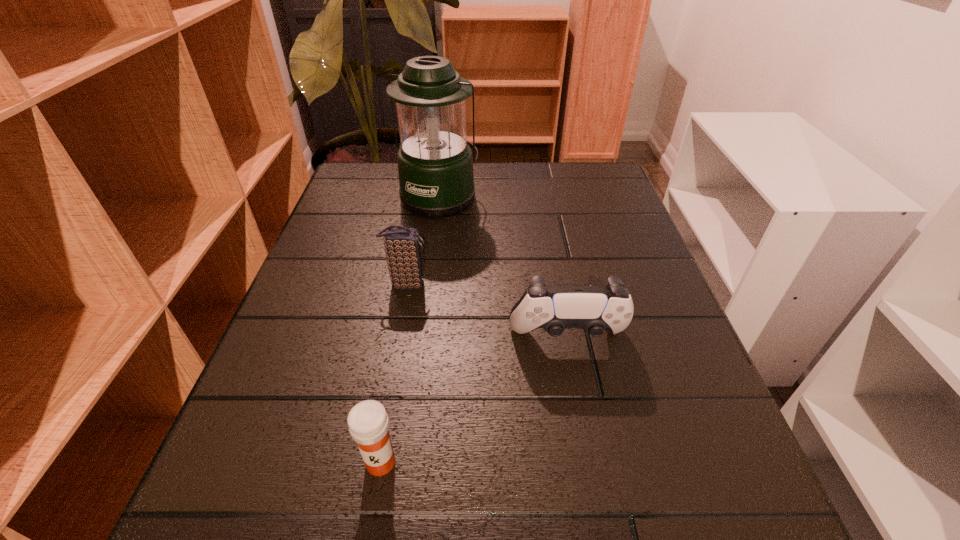
Find the location of a particular element. The height and width of the screenshot is (540, 960). unoccupied position between the nearest object and the tallest object is located at coordinates (410, 329).

I want to click on vacant area between the rightmost object and the farthest object, so click(504, 268).

This screenshot has width=960, height=540. I want to click on free space between the nearest object and the third nearest object, so click(394, 373).

You are a GUI agent. You are given a task and a screenshot of the screen. Output one action in this format:
    pyautogui.click(x=<x>, y=<y>)
    Task: Click on the free space that is in between the third farthest object and the lantern
    Image resolution: width=960 pixels, height=540 pixels.
    Given the screenshot: What is the action you would take?
    pyautogui.click(x=504, y=268)

Where is `blank region between the lantern and the rightmost object`? The height and width of the screenshot is (540, 960). blank region between the lantern and the rightmost object is located at coordinates (504, 268).

What are the coordinates of `vacant area between the control and the tallest object` in the screenshot? It's located at (504, 268).

Find the location of a particular element. The height and width of the screenshot is (540, 960). free space between the lantern and the clutch bag is located at coordinates (423, 240).

Identify the location of vacant space that is in between the third farthest object and the second farthest object. (487, 312).

This screenshot has width=960, height=540. Find the location of `free area in between the clutch bag and the medicine`. free area in between the clutch bag and the medicine is located at coordinates (394, 373).

Locate an element on the screen. The image size is (960, 540). free spot between the second farthest object and the medicine is located at coordinates [x=394, y=373].